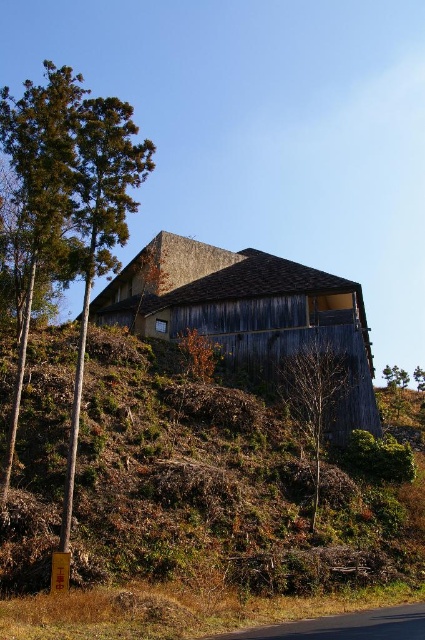
You are standing on the hillside looking at the weathered wood barn at center and the green textured tree at left. Which object is closer to you?

The weathered wood barn at center is closer to you because it is positioned under the green textured tree at left, meaning the barn is in front of the tree.

You are standing in front of a rustic wooden building on a hillside. You notice the brown wood hillside at center and the green textured tree at left. Which object is taller?

The green textured tree at left is taller than the brown wood hillside at center.

You are standing at the base of the hill and looking up at the rustic wooden structure. There is a point marked at coordinates point (x=223, y=484). Which object in the scene corresponds to this point?

The point (x=223, y=484) corresponds to the brown wood hillside at center.